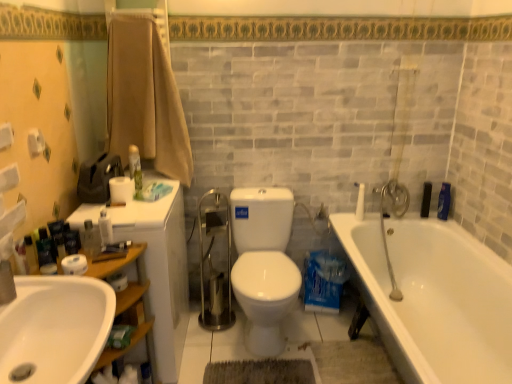
Where is `space that is in front of black matte razor at right, the 5th toiletry when ordered from left to right`? This screenshot has width=512, height=384. space that is in front of black matte razor at right, the 5th toiletry when ordered from left to right is located at coordinates (439, 225).